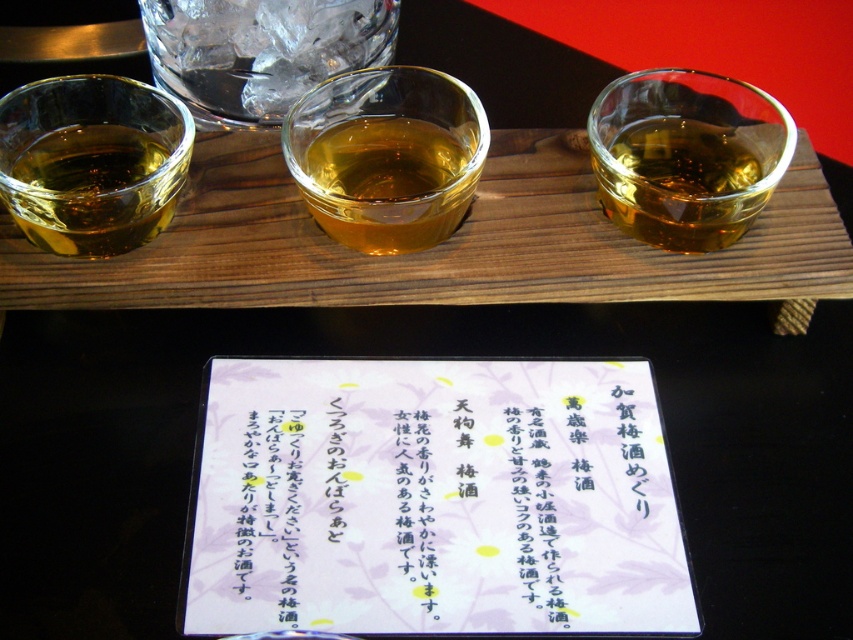
Measure the distance between translucent glass at upper center and translucent amber liquid at left.

translucent glass at upper center and translucent amber liquid at left are 2.60 inches apart from each other.

Is translucent glass at upper center taller than translucent amber liquid at left?

In fact, translucent glass at upper center may be shorter than translucent amber liquid at left.

The height and width of the screenshot is (640, 853). Identify the location of translucent glass at upper center. (260, 51).

Between translucent amber liquid at center and translucent amber liquid at right, which one is positioned higher?

Positioned higher is translucent amber liquid at right.

Can you confirm if translucent amber liquid at center is taller than translucent amber liquid at right?

Indeed, translucent amber liquid at center has a greater height compared to translucent amber liquid at right.

Is point (334, 230) positioned before point (689, 248)?

Yes.

You are a GUI agent. You are given a task and a screenshot of the screen. Output one action in this format:
    pyautogui.click(x=<x>, y=<y>)
    Task: Click on the translucent amber liquid at center
    This screenshot has height=640, width=853.
    Given the screenshot: What is the action you would take?
    pyautogui.click(x=389, y=180)

Does white paper at center have a greater width compared to translucent amber liquid at left?

Yes.

Which of these two, white paper at center or translucent amber liquid at left, stands shorter?

Standing shorter between the two is translucent amber liquid at left.

Is point (254, 387) positioned before point (119, 154)?

Yes, it is in front of point (119, 154).

Identify the location of white paper at center. (440, 502).